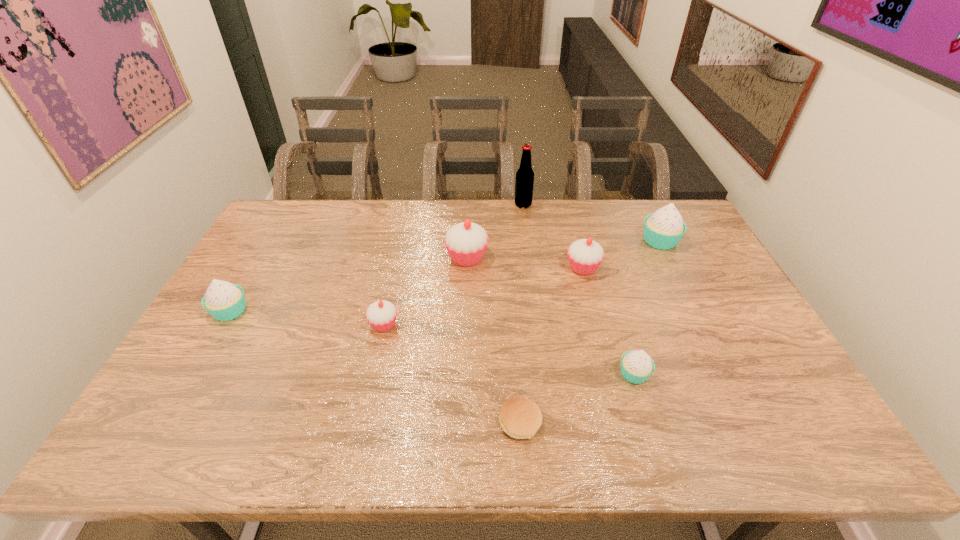
Where is `blank area located on the right of the second cupcake from left to right`? blank area located on the right of the second cupcake from left to right is located at coordinates (464, 325).

Identify the location of vacant space situated 0.210m on the back of the second nearest object. This screenshot has height=540, width=960. (612, 303).

Identify the location of vacant space located 0.170m on the back of the shortest object. (515, 348).

Locate an element on the screen. Image resolution: width=960 pixels, height=540 pixels. beer bottle present at the far edge is located at coordinates (524, 182).

Locate an element on the screen. The width and height of the screenshot is (960, 540). cupcake that is at the far edge is located at coordinates (663, 229).

Identify the location of object located at the near edge. This screenshot has width=960, height=540. (520, 418).

Identify the location of object that is at the left edge. (224, 301).

I want to click on object at the right edge, so click(663, 229).

The image size is (960, 540). In order to click on object located in the far right corner section of the desktop in this screenshot , I will do `click(663, 229)`.

This screenshot has height=540, width=960. In the image, there is a desktop. In order to click on vacant space at the far edge in this screenshot , I will do `click(317, 218)`.